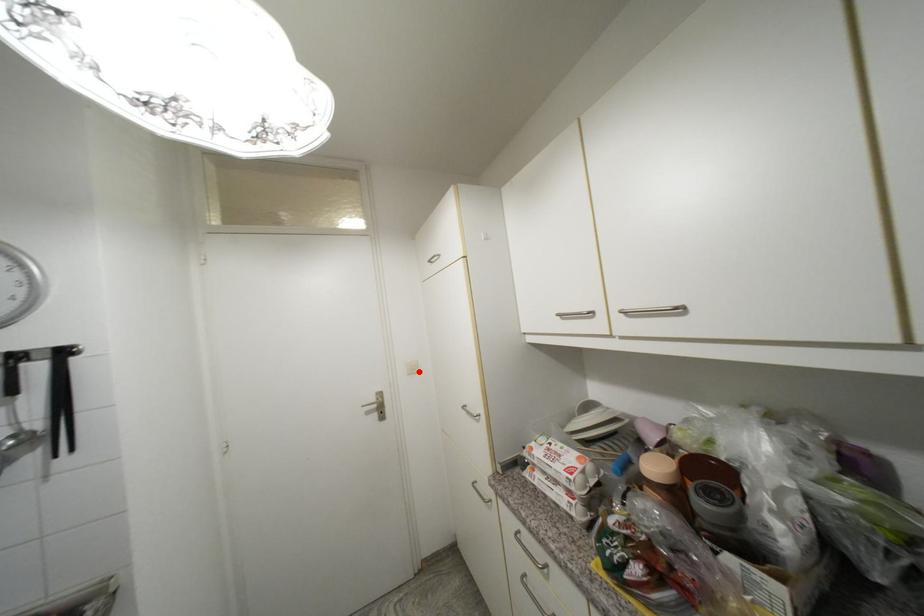
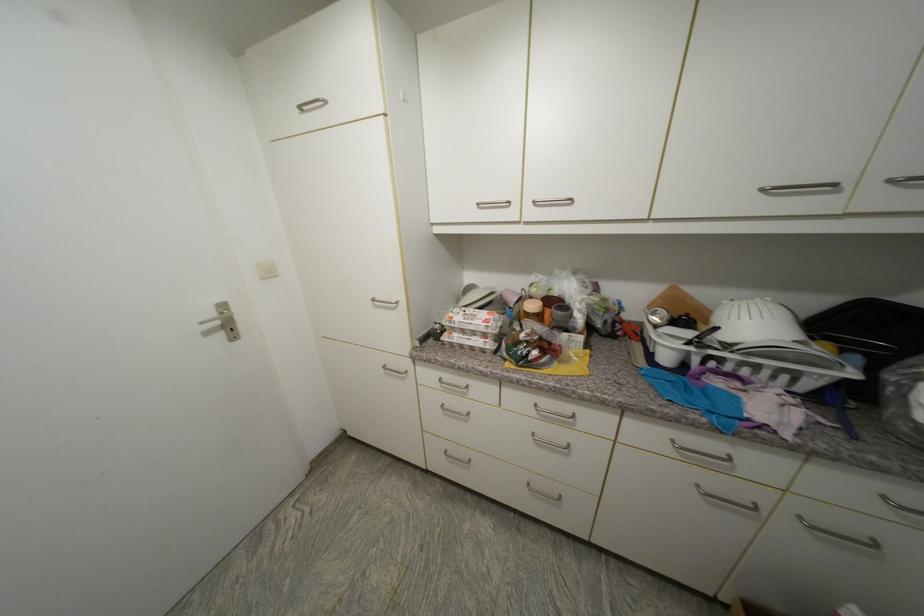
In the second image, find the point that corresponds to the highlighted location in the first image.

(274, 275)